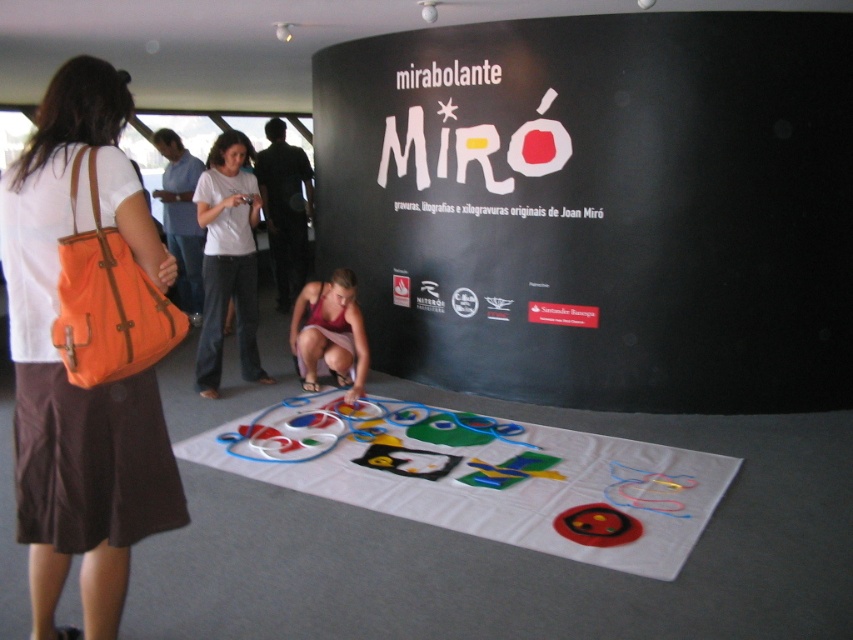
You are organizing an art exhibit and need to display two garments on a mannequin. The garments are the white cotton shirt at center and the pink fabric dress at center. Which garment should you choose if you want the one that takes up less horizontal space?

The white cotton shirt at center has a lesser width compared to the pink fabric dress at center, so you should choose the white cotton shirt at center for the display.

You are an art assistant who needs to place a new art piece on the table. The new piece is slightly smaller than the white cotton shirt at center. Where should you place it so that it fits without overlapping the soft felt mat at center?

Since the soft felt mat at center is bigger than the white cotton shirt at center, the new piece, being smaller than the white cotton shirt at center, will also be smaller than the soft felt mat at center. Therefore, you should place it on the table away from the soft felt mat at center to ensure it doesn not overlap.

In the scene shown: You are an art curator organizing an exhibition. You have two garments displayed at the center of the table for an interactive art activity. The garments are the white cotton shirt at center and the pink fabric dress at center. Which garment is positioned higher on the table?

The white cotton shirt at center is above the pink fabric dress at center, so it is positioned higher on the table.